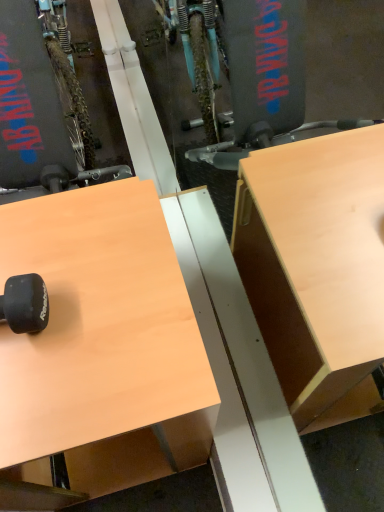
Question: Could you tell me if black rubber dumbbell at lower left is facing light brown wood desk at upper left?

Choices:
 (A) yes
 (B) no

Answer: (B)

Question: Is black rubber dumbbell at lower left taller than light brown wood desk at upper left?

Choices:
 (A) yes
 (B) no

Answer: (B)

Question: Does black rubber dumbbell at lower left come in front of light brown wood desk at upper left?

Choices:
 (A) no
 (B) yes

Answer: (A)

Question: From a real-world perspective, is black rubber dumbbell at lower left located higher than light brown wood desk at upper left?

Choices:
 (A) no
 (B) yes

Answer: (B)

Question: Could light brown wood desk at upper left be considered to be inside black rubber dumbbell at lower left?

Choices:
 (A) yes
 (B) no

Answer: (B)

Question: Is black rubber dumbbell at lower left outside of light brown wood desk at upper left?

Choices:
 (A) no
 (B) yes

Answer: (B)

Question: Considering the relative positions of light brown wood desk at upper left and black rubber dumbbell at lower left in the image provided, is light brown wood desk at upper left in front of black rubber dumbbell at lower left?

Choices:
 (A) no
 (B) yes

Answer: (B)

Question: From a real-world perspective, is light brown wood desk at upper left physically above black rubber dumbbell at lower left?

Choices:
 (A) no
 (B) yes

Answer: (A)

Question: Are light brown wood desk at upper left and black rubber dumbbell at lower left located far from each other?

Choices:
 (A) yes
 (B) no

Answer: (B)

Question: Does light brown wood desk at upper left touch black rubber dumbbell at lower left?

Choices:
 (A) no
 (B) yes

Answer: (A)

Question: Does light brown wood desk at upper left have a lesser width compared to black rubber dumbbell at lower left?

Choices:
 (A) yes
 (B) no

Answer: (B)

Question: Is light brown wood desk at upper left positioned beyond the bounds of black rubber dumbbell at lower left?

Choices:
 (A) no
 (B) yes

Answer: (B)

Question: In the image, is black rubber dumbbell at lower left positioned in front of or behind light brown wood desk at upper left?

Choices:
 (A) front
 (B) behind

Answer: (B)